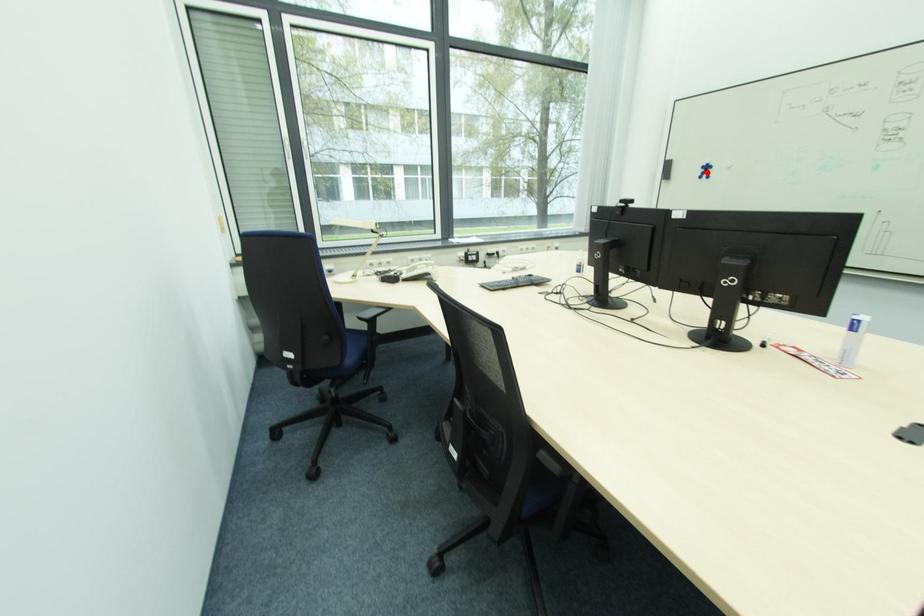
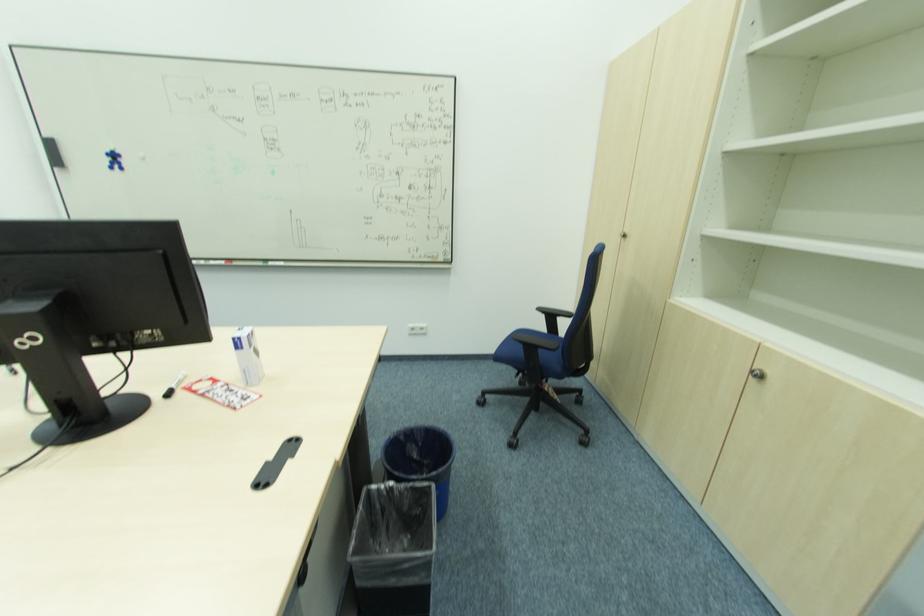
In the second image, find the point that corresponds to the highlighted location in the first image.

(116, 161)